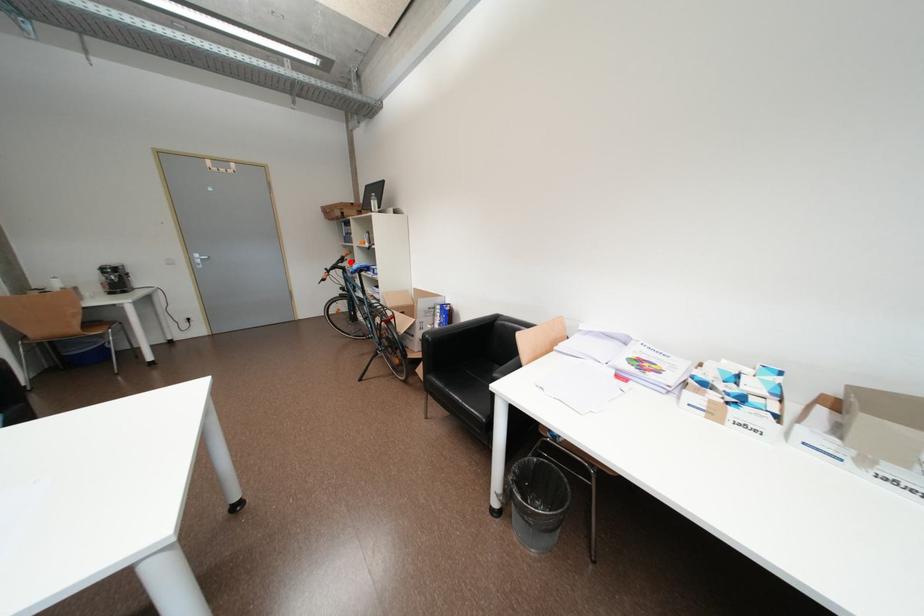
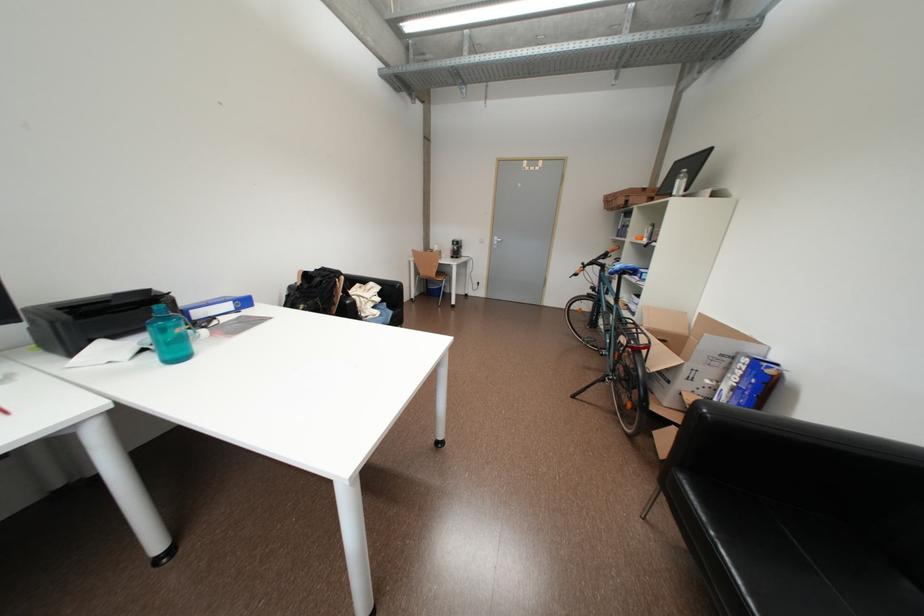
Question: I am providing you with two images of the same scene from different viewpoints. A red point is shown in image1. For the corresponding object point in image2, is it positioned nearer or farther from the camera?

Choices:
 (A) Nearer
 (B) Farther

Answer: (B)